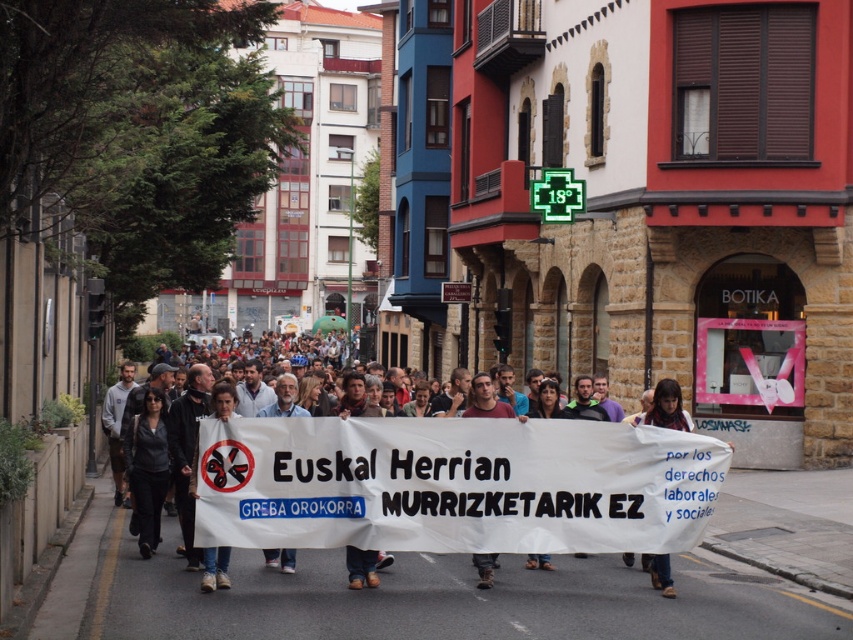
Question: Which point appears farthest from the camera in this image?

Choices:
 (A) (664, 388)
 (B) (682, 493)

Answer: (A)

Question: Does white paper banner at center have a smaller size compared to dark brown leather shoes at lower center?

Choices:
 (A) yes
 (B) no

Answer: (B)

Question: Is white paper banner at center to the right of dark brown leather shoes at lower center from the viewer's perspective?

Choices:
 (A) yes
 (B) no

Answer: (B)

Question: Is white paper banner at center below dark brown leather shoes at lower center?

Choices:
 (A) yes
 (B) no

Answer: (A)